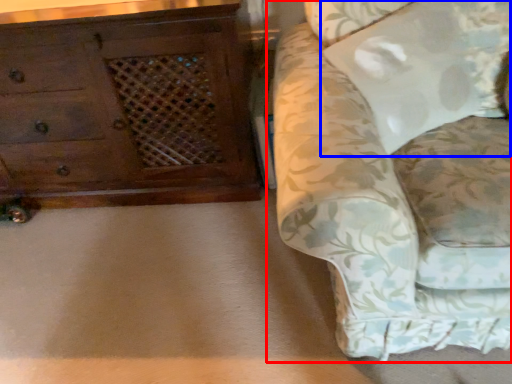
Question: Which point is further to the camera, studio couch (highlighted by a red box) or pillow (highlighted by a blue box)?

Choices:
 (A) studio couch
 (B) pillow

Answer: (B)